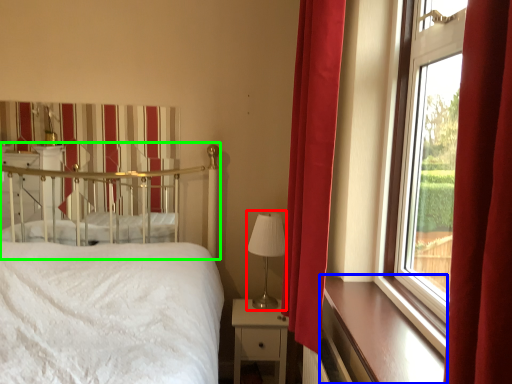
Question: Considering the real-world distances, which object is closest to table lamp (highlighted by a red box)? window sill (highlighted by a blue box) or canopy bed (highlighted by a green box).

Choices:
 (A) window sill
 (B) canopy bed

Answer: (A)